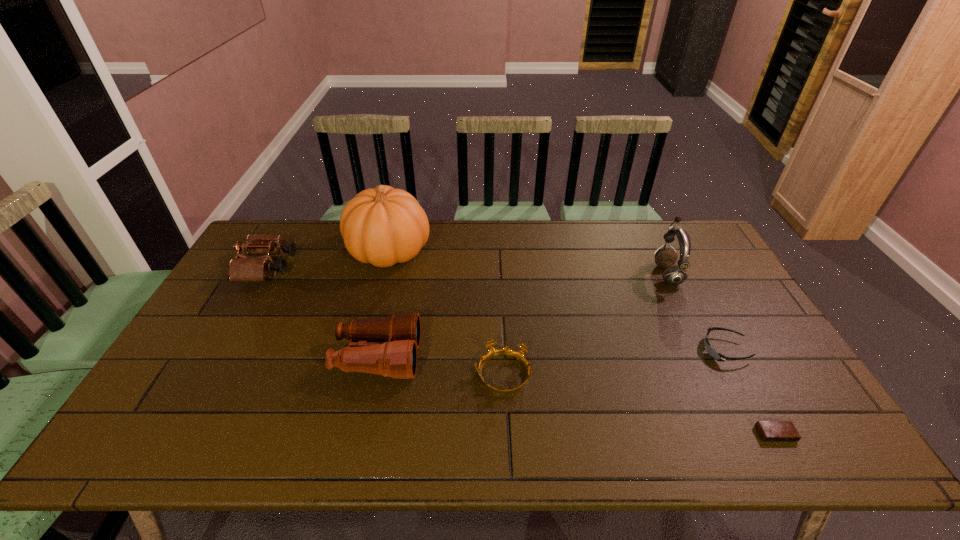
The image size is (960, 540). I want to click on pumpkin at the far edge, so click(x=383, y=226).

This screenshot has height=540, width=960. In order to click on earphone present at the far edge in this screenshot , I will do `click(673, 275)`.

Find the location of a particular element. binoculars that is at the far edge is located at coordinates (247, 269).

I want to click on object at the near edge, so click(770, 431).

The image size is (960, 540). I want to click on object that is positioned at the left edge, so click(x=247, y=269).

Locate an element on the screen. The width and height of the screenshot is (960, 540). earphone present at the right edge is located at coordinates (673, 275).

Where is `sunglasses present at the right edge`? The height and width of the screenshot is (540, 960). sunglasses present at the right edge is located at coordinates (714, 354).

The width and height of the screenshot is (960, 540). In order to click on alarm clock that is positioned at the right edge in this screenshot , I will do `click(770, 431)`.

You are a GUI agent. You are given a task and a screenshot of the screen. Output one action in this format:
    pyautogui.click(x=<x>, y=<y>)
    Task: Click on the object at the far left corner
    This screenshot has height=540, width=960.
    Given the screenshot: What is the action you would take?
    pyautogui.click(x=247, y=269)

Image resolution: width=960 pixels, height=540 pixels. Identify the location of object at the far right corner. (673, 275).